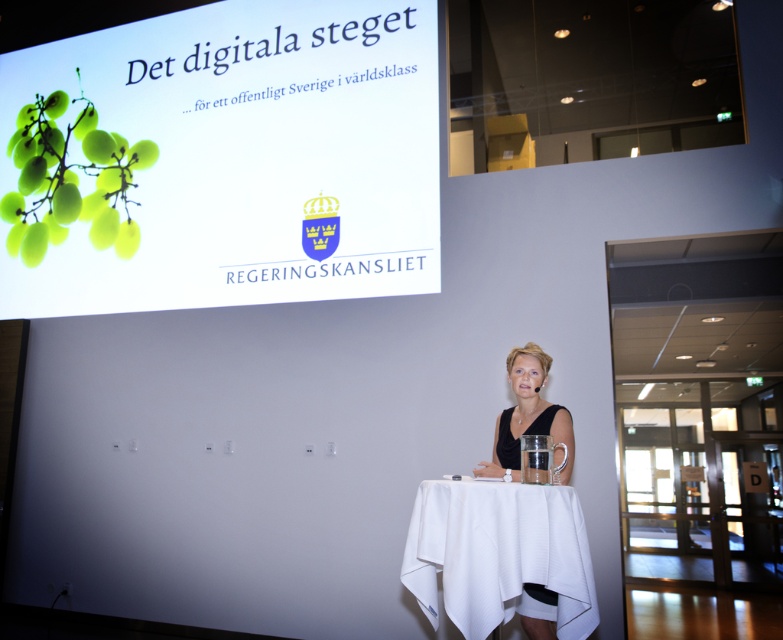
You are an attendee at the presentation and want to determine which of the two points, point (x=424, y=74) or point (x=466, y=525), is closer to you. Based on the scene description, which point is nearer?

Point (x=424, y=74) is further to the viewer than point (x=466, y=525), so the closer point to you is point (x=466, y=525).